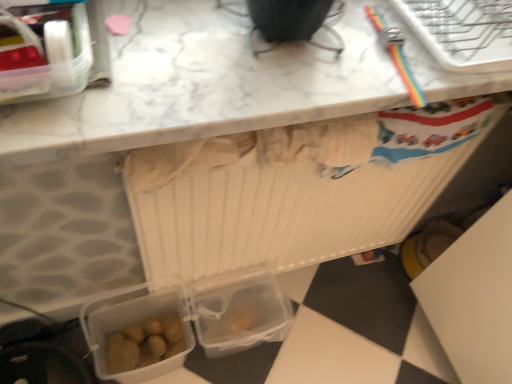
The height and width of the screenshot is (384, 512). I want to click on unoccupied area in front of rainbow plastic bracelet at upper right, so click(x=351, y=84).